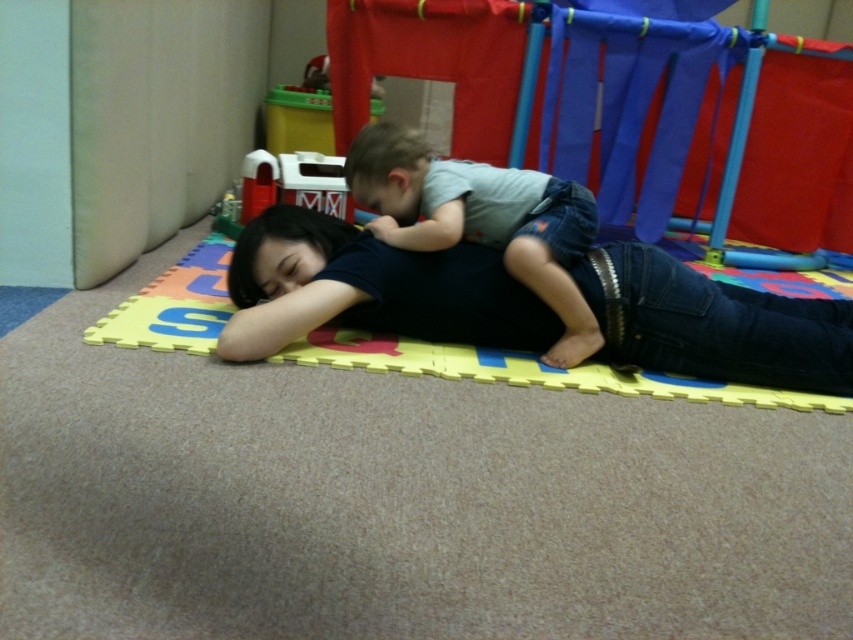
You are a photographer standing in front of the scene. You want to take a photo that includes both the point at position (515,227) and the point at (850,406). Which point is closer to you so that you can focus on it first?

Point (515,227) is closer to you than point (850,406), so you can focus on it first.

You are a delivery robot trying to deliver a package to the woman on the left. The package is placed at point (480, 220). Can you reach the woman on the left directly from this point without moving the child?

The point (480, 220) is on light gray denim pants at center, which is likely the child wearing light colored shirt and jeans. Since the child is on top of the woman, moving the package from the child might require moving the child to reach the woman directly.